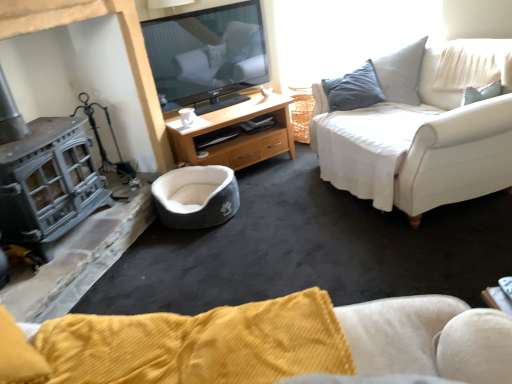
Find the location of `free spot in front of gray plush pet bed at center`. free spot in front of gray plush pet bed at center is located at coordinates (207, 252).